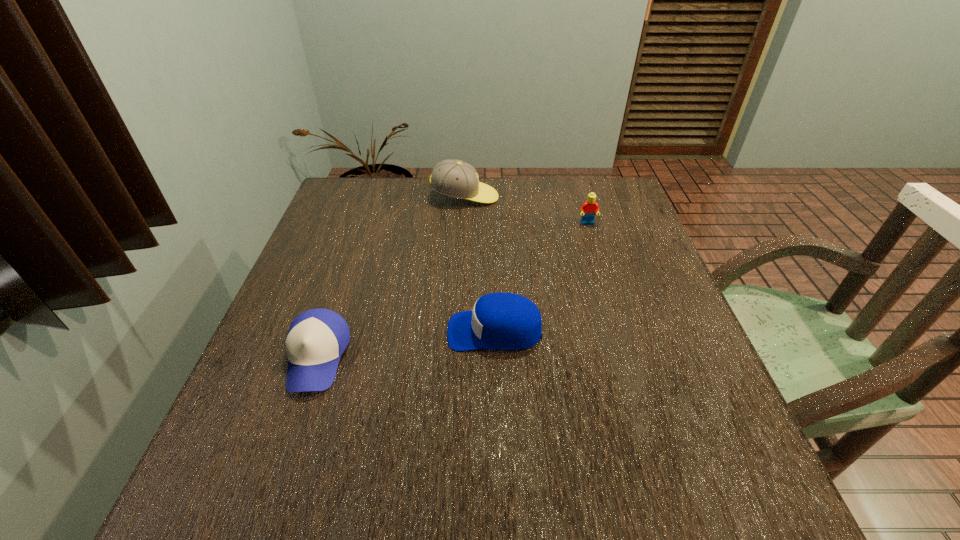
Where is `the tallest object`? The image size is (960, 540). the tallest object is located at coordinates (457, 179).

You are a GUI agent. You are given a task and a screenshot of the screen. Output one action in this format:
    pyautogui.click(x=<x>, y=<y>)
    Task: Click on the tallest baseball cap
    
    Given the screenshot: What is the action you would take?
    pyautogui.click(x=457, y=179)

The image size is (960, 540). I want to click on Lego, so click(590, 207).

In order to click on the third nearest object in this screenshot , I will do `click(590, 207)`.

Identify the location of the leftmost baseball cap. point(316,339).

Where is `free spot located 0.390m on the front-facing side of the tallest baseball cap`? The height and width of the screenshot is (540, 960). free spot located 0.390m on the front-facing side of the tallest baseball cap is located at coordinates (626, 197).

The image size is (960, 540). I want to click on vacant space situated on the face of the third nearest object, so click(617, 319).

I want to click on vacant space located 0.080m on the front-facing side of the leftmost baseball cap, so click(290, 438).

Where is `baseball cap that is at the far edge`? The image size is (960, 540). baseball cap that is at the far edge is located at coordinates (457, 179).

The height and width of the screenshot is (540, 960). I want to click on Lego that is at the far edge, so click(590, 207).